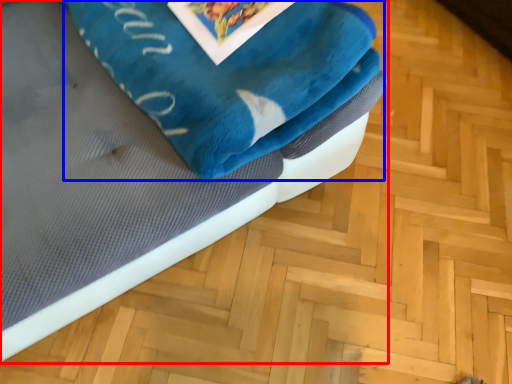
Question: Which object appears closest to the camera in this image, furniture (highlighted by a red box) or bath towel (highlighted by a blue box)?

Choices:
 (A) furniture
 (B) bath towel

Answer: (A)